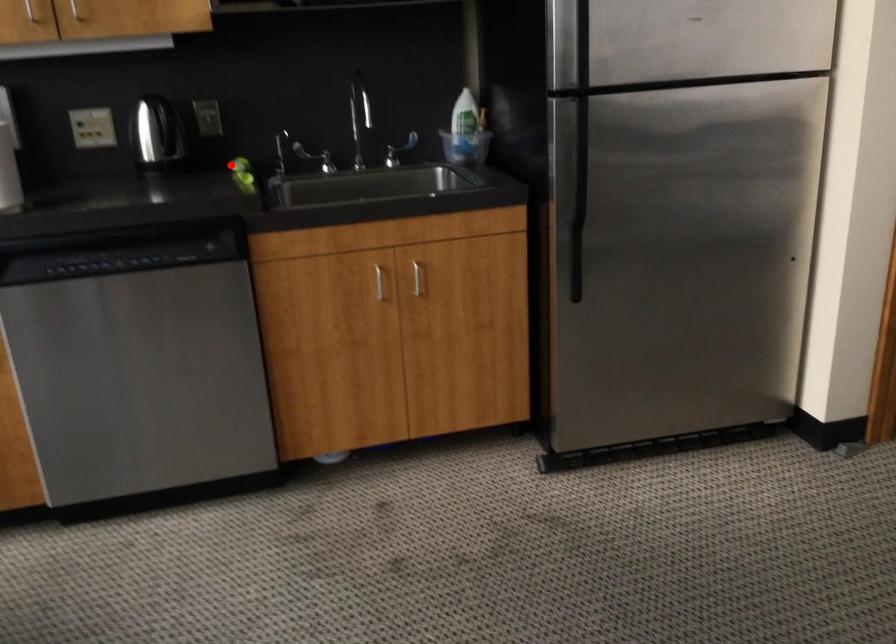
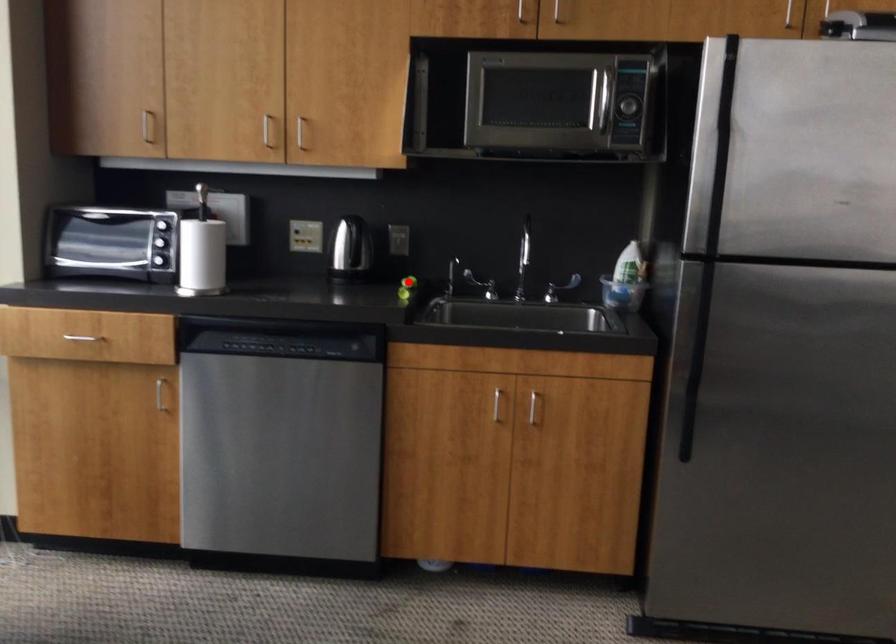
I am providing you with two images of the same scene from different viewpoints. A red point is marked on the first image and another point is marked on the second image. Do the highlighted points in image1 and image2 indicate the same real-world spot?

Yes